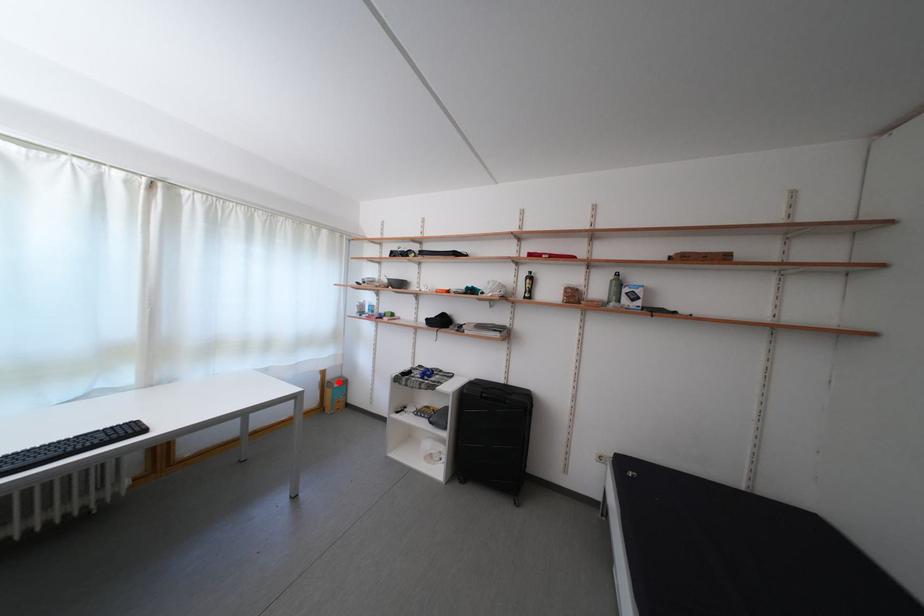
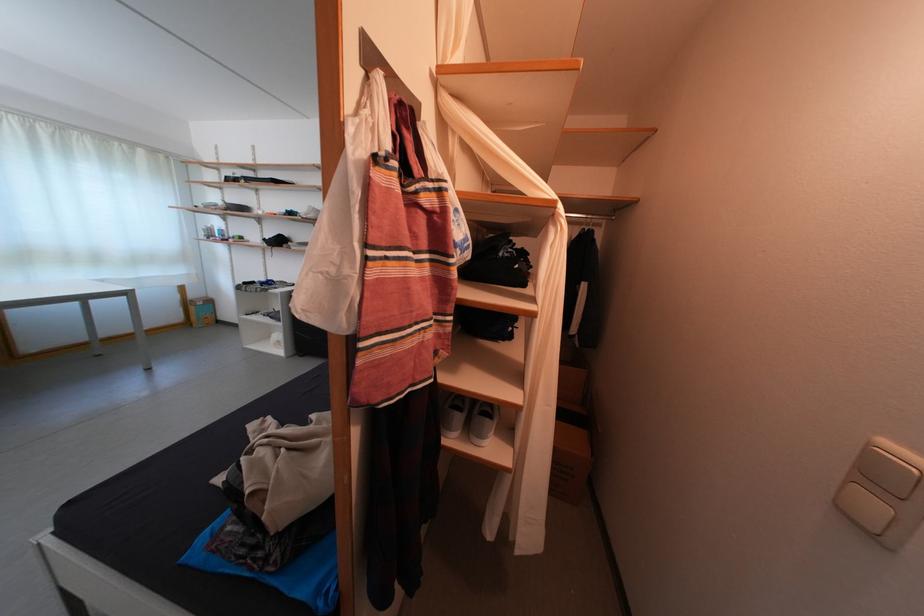
In the second image, find the point that corresponds to the highlighted location in the first image.

(201, 302)